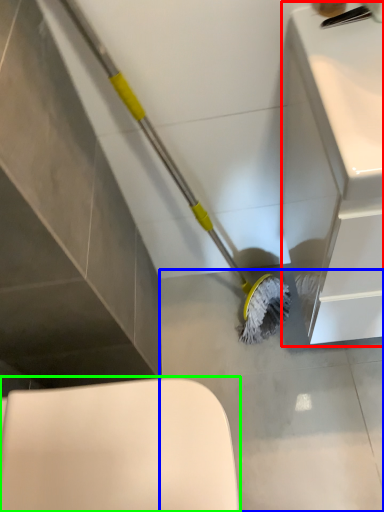
Question: Estimate the real-world distances between objects in this image. Which object is closer to counter top (highlighted by a red box), concrete (highlighted by a blue box) or toilet (highlighted by a green box)?

Choices:
 (A) concrete
 (B) toilet

Answer: (A)